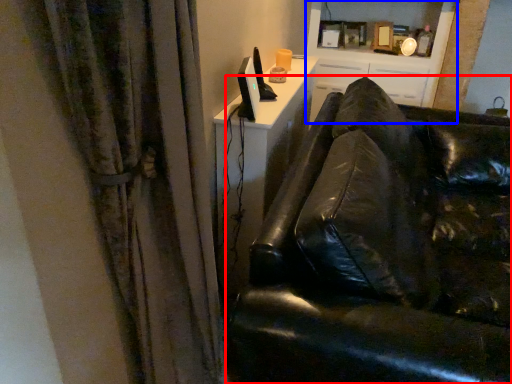
Question: Which object is closer to the camera taking this photo, studio couch (highlighted by a red box) or entertainment center (highlighted by a blue box)?

Choices:
 (A) studio couch
 (B) entertainment center

Answer: (A)